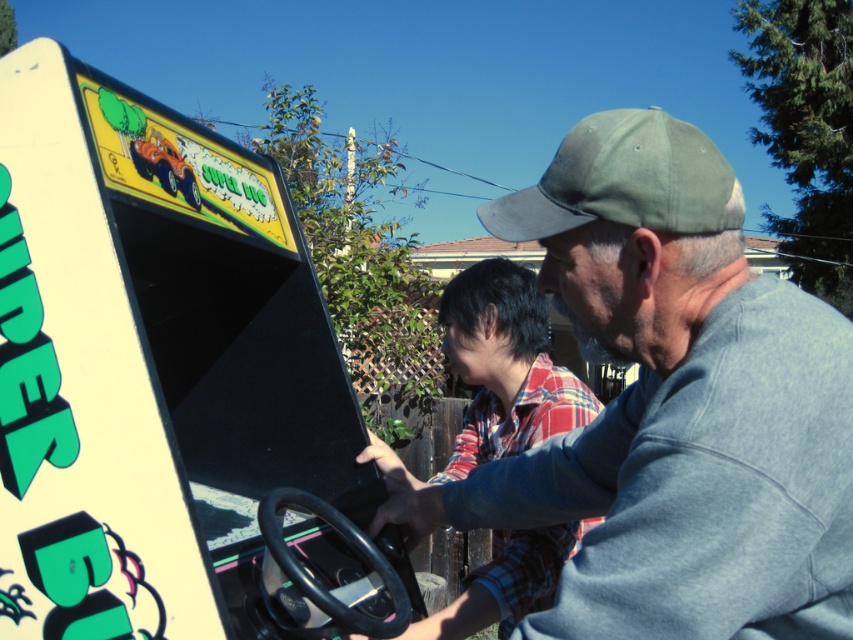
Can you confirm if gray cotton shirt at center is positioned above green fabric baseball cap at upper center?

No.

Is gray cotton shirt at center bigger than green fabric baseball cap at upper center?

Yes.

Is point (582, 465) less distant than point (564, 176)?

No, (582, 465) is behind (564, 176).

Locate an element on the screen. gray cotton shirt at center is located at coordinates (672, 406).